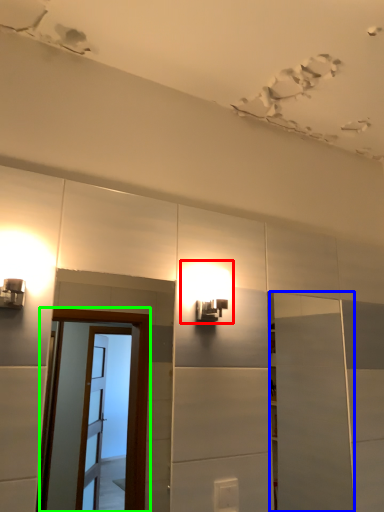
Question: Estimate the real-world distances between objects in this image. Which object is closer to light fixture (highlighted by a red box), door (highlighted by a blue box) or screen door (highlighted by a green box)?

Choices:
 (A) door
 (B) screen door

Answer: (A)